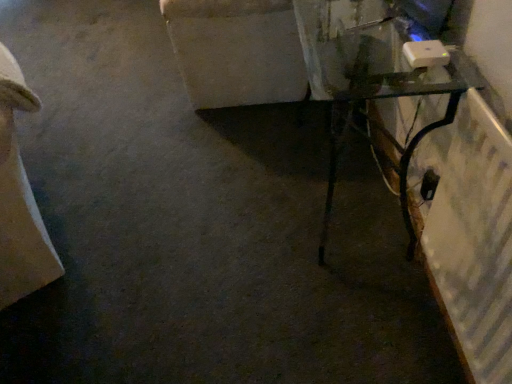
Question: Can you confirm if beige fabric couch at left is taller than blue glossy monitor at upper right?

Choices:
 (A) no
 (B) yes

Answer: (B)

Question: Is beige fabric couch at left to the left of blue glossy monitor at upper right from the viewer's perspective?

Choices:
 (A) no
 (B) yes

Answer: (B)

Question: Is beige fabric couch at left facing towards blue glossy monitor at upper right?

Choices:
 (A) no
 (B) yes

Answer: (A)

Question: Is beige fabric couch at left in front of blue glossy monitor at upper right?

Choices:
 (A) yes
 (B) no

Answer: (A)

Question: Is beige fabric couch at left oriented away from blue glossy monitor at upper right?

Choices:
 (A) yes
 (B) no

Answer: (B)

Question: Is transparent glass table at right inside or outside of beige fabric couch at left?

Choices:
 (A) outside
 (B) inside

Answer: (A)

Question: Looking at the image, does transparent glass table at right seem bigger or smaller compared to beige fabric couch at left?

Choices:
 (A) big
 (B) small

Answer: (B)

Question: From the image's perspective, is transparent glass table at right located above or below beige fabric couch at left?

Choices:
 (A) below
 (B) above

Answer: (B)

Question: From a real-world perspective, relative to beige fabric couch at left, is transparent glass table at right vertically above or below?

Choices:
 (A) below
 (B) above

Answer: (A)

Question: In the image, is beige fabric couch at left positioned in front of or behind blue glossy monitor at upper right?

Choices:
 (A) behind
 (B) front

Answer: (B)

Question: Would you say beige fabric couch at left is inside or outside blue glossy monitor at upper right?

Choices:
 (A) inside
 (B) outside

Answer: (B)

Question: From a real-world perspective, is beige fabric couch at left above or below blue glossy monitor at upper right?

Choices:
 (A) below
 (B) above

Answer: (A)

Question: Is beige fabric couch at left to the left or to the right of blue glossy monitor at upper right in the image?

Choices:
 (A) left
 (B) right

Answer: (A)

Question: Based on their positions, is blue glossy monitor at upper right located to the left or right of transparent glass table at right?

Choices:
 (A) right
 (B) left

Answer: (A)

Question: In terms of height, does blue glossy monitor at upper right look taller or shorter compared to transparent glass table at right?

Choices:
 (A) short
 (B) tall

Answer: (A)